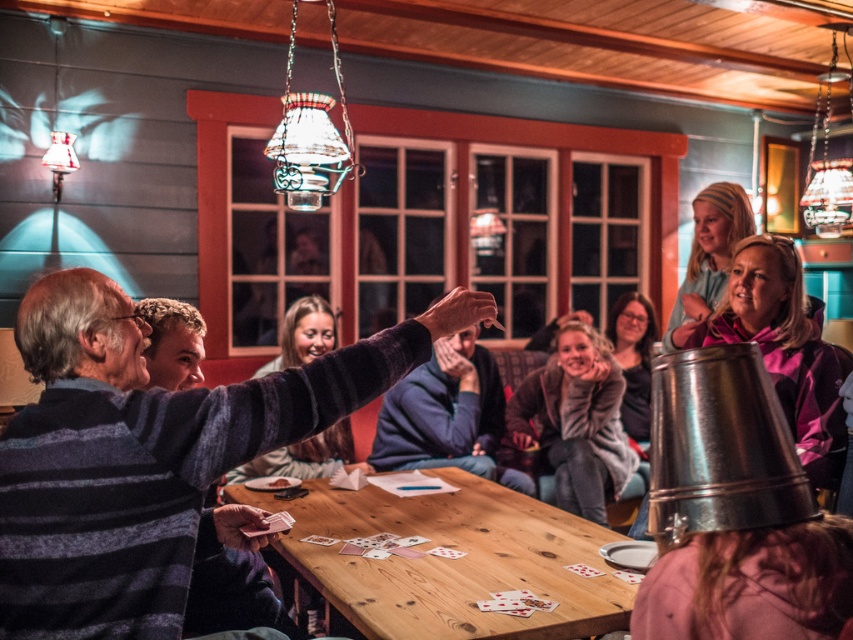
Question: Is wooden table at center positioned at the back of purple fabric scarf at upper right?

Choices:
 (A) no
 (B) yes

Answer: (A)

Question: Does wooden table at center have a smaller size compared to purple fabric scarf at upper right?

Choices:
 (A) no
 (B) yes

Answer: (A)

Question: Among these points, which one is nearest to the camera?

Choices:
 (A) (579, 369)
 (B) (448, 627)
 (C) (112, 316)

Answer: (C)

Question: Which object is the farthest from the striped sweater at center?

Choices:
 (A) velvet-like sweater at center
 (B) wooden table at center

Answer: (A)

Question: Does wooden table at center appear on the left side of purple fabric scarf at upper right?

Choices:
 (A) yes
 (B) no

Answer: (A)

Question: Which is nearer to the striped sweater at center?

Choices:
 (A) wooden table at center
 (B) velvet-like sweater at center

Answer: (A)